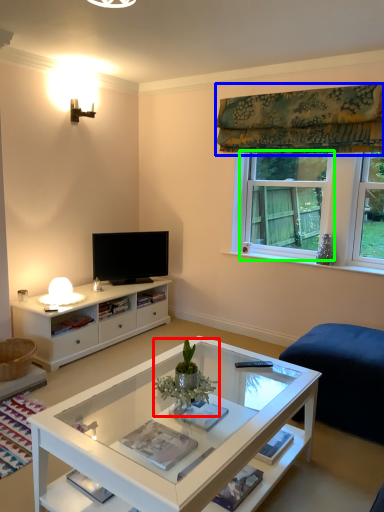
Question: Which object is positioned closest to houseplant (highlighted by a red box)? Select from curtain (highlighted by a blue box) and window (highlighted by a green box).

Choices:
 (A) curtain
 (B) window

Answer: (B)